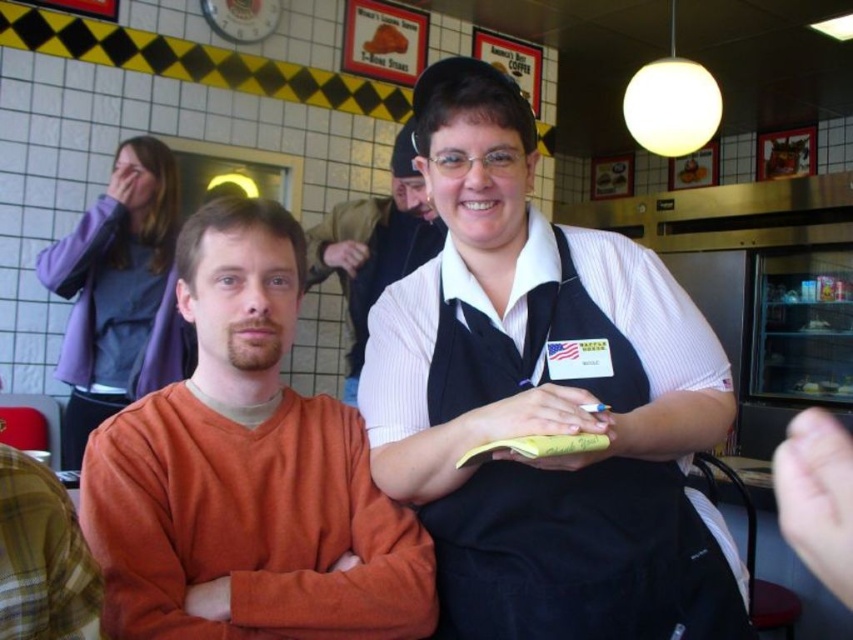
Question: Which point appears closest to the camera in this image?

Choices:
 (A) (311, 566)
 (B) (358, 310)
 (C) (572, 476)

Answer: (C)

Question: Is matte orange shirt at center to the left of orange cotton shirt at center from the viewer's perspective?

Choices:
 (A) yes
 (B) no

Answer: (B)

Question: Does orange cotton shirt at center have a smaller size compared to white ribbed sweater at center?

Choices:
 (A) yes
 (B) no

Answer: (A)

Question: Which point is farther to the camera?

Choices:
 (A) matte orange shirt at center
 (B) white ribbed sweater at center
 (C) orange cotton shirt at center

Answer: (B)

Question: Is matte orange shirt at center thinner than orange cotton shirt at center?

Choices:
 (A) no
 (B) yes

Answer: (A)

Question: Which point is farther to the camera?

Choices:
 (A) matte orange shirt at center
 (B) orange cotton shirt at center
 (C) white ribbed sweater at center

Answer: (C)